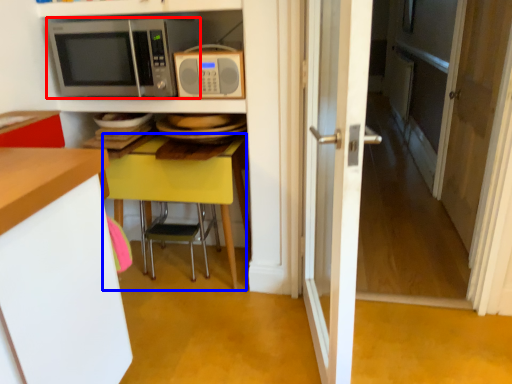
Question: Which of the following is the farthest to the observer, microwave oven (highlighted by a red box) or table (highlighted by a blue box)?

Choices:
 (A) microwave oven
 (B) table

Answer: (B)